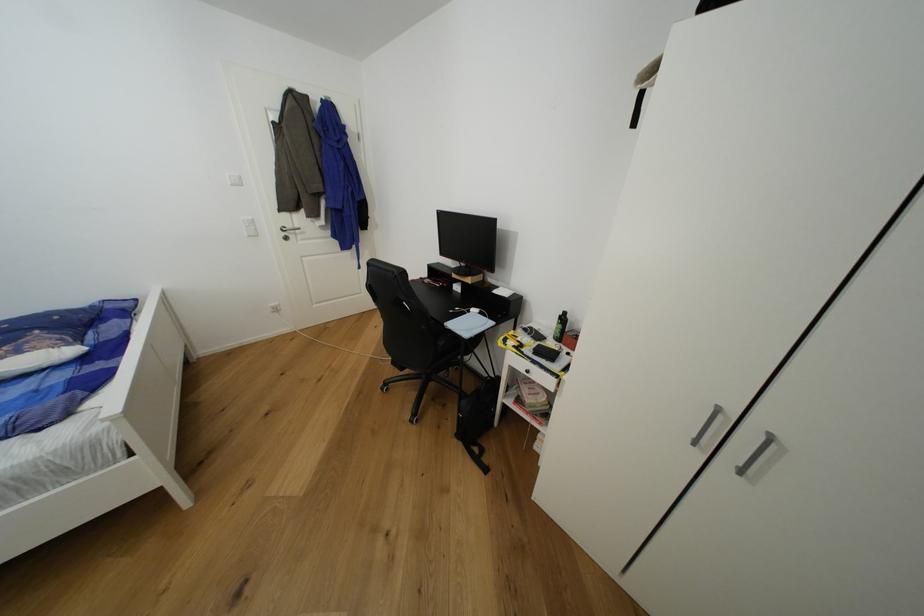
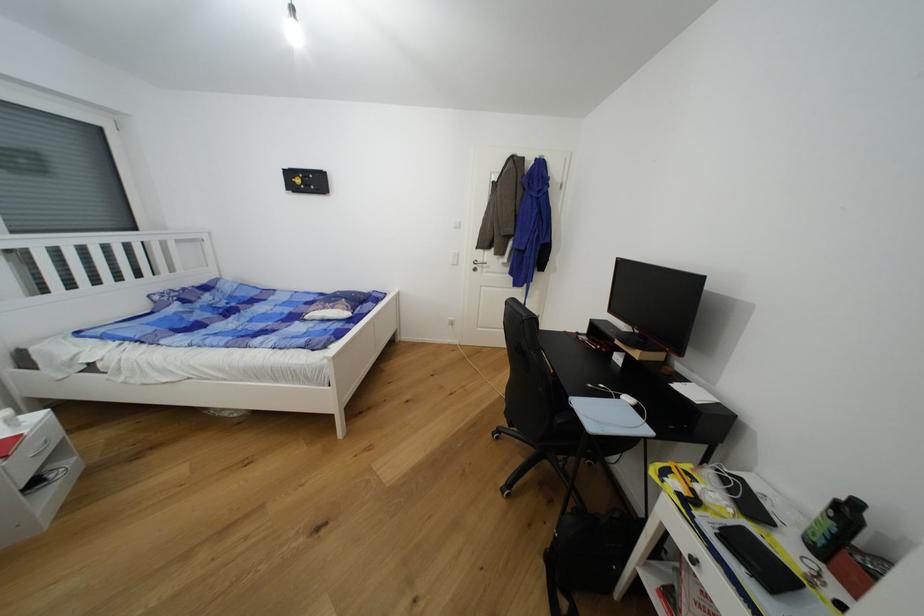
In the second image, find the point that corresponds to [295,228] in the first image.

(484, 262)